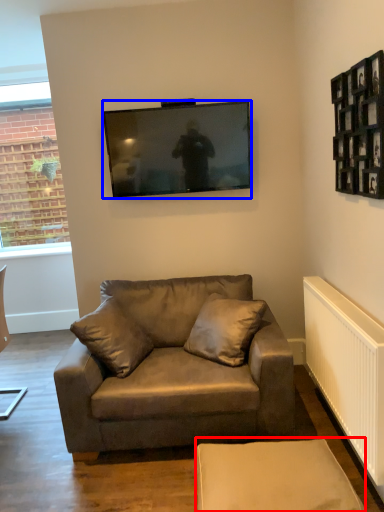
Question: Which point is further to the camera, swivel chair (highlighted by a red box) or television (highlighted by a blue box)?

Choices:
 (A) swivel chair
 (B) television

Answer: (B)